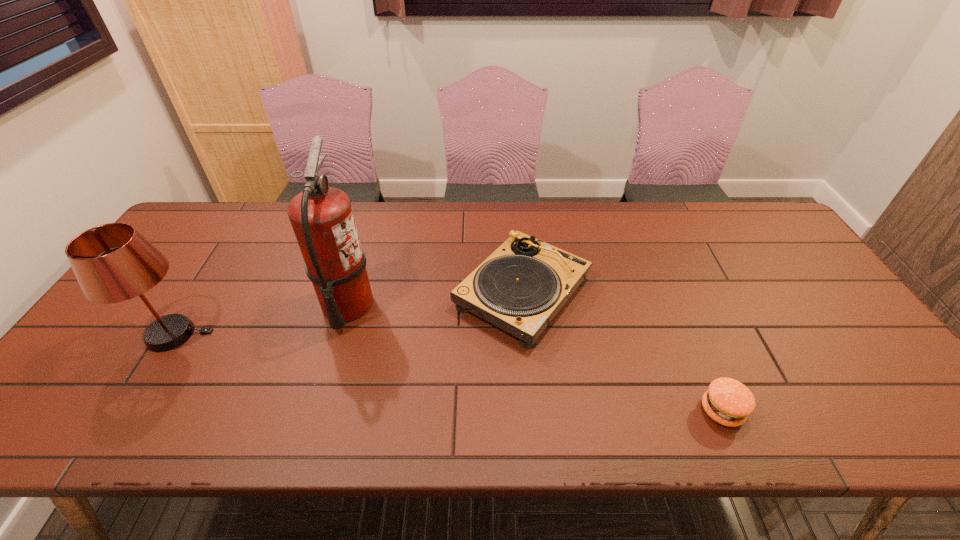
This screenshot has height=540, width=960. I want to click on vacant position located 0.210m on the front of the record player, so click(x=536, y=434).

Locate an element on the screen. The height and width of the screenshot is (540, 960). free spot located 0.070m on the back of the shortest object is located at coordinates (703, 366).

Locate an element on the screen. object that is positioned at the far edge is located at coordinates (522, 285).

Image resolution: width=960 pixels, height=540 pixels. I want to click on object at the near edge, so pyautogui.click(x=728, y=402).

What are the coordinates of `object that is at the left edge` in the screenshot? It's located at (113, 262).

Locate an element on the screen. The image size is (960, 540). free space at the far edge of the desktop is located at coordinates (505, 231).

Identify the location of free space at the near edge of the desktop. The width and height of the screenshot is (960, 540). (598, 436).

In the image, there is a desktop. Where is `vacant area at the right edge`? The width and height of the screenshot is (960, 540). vacant area at the right edge is located at coordinates click(806, 272).

Identify the location of vacant space at the far left corner. Image resolution: width=960 pixels, height=540 pixels. (225, 211).

Where is `blank region between the third object from left to right and the nearest object`? blank region between the third object from left to right and the nearest object is located at coordinates (622, 352).